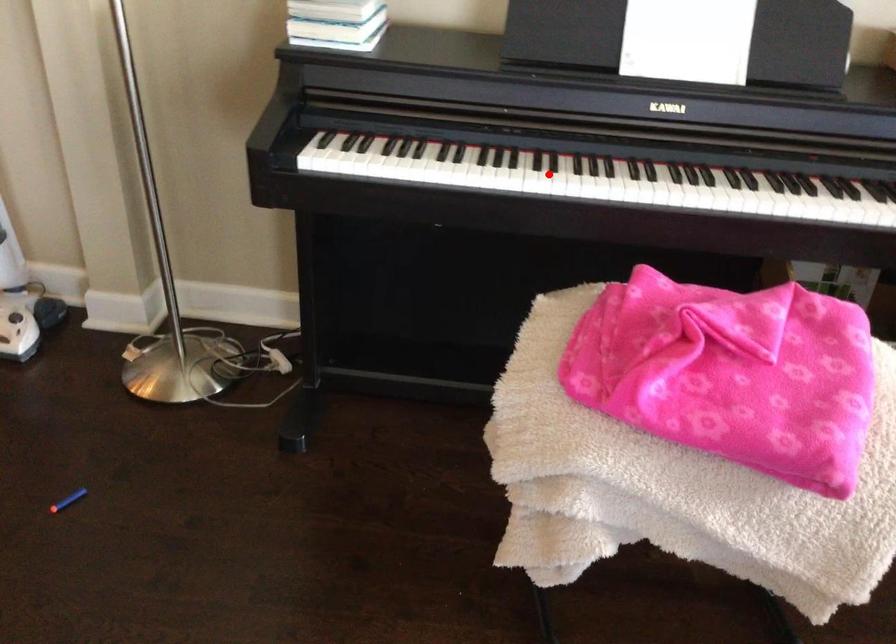
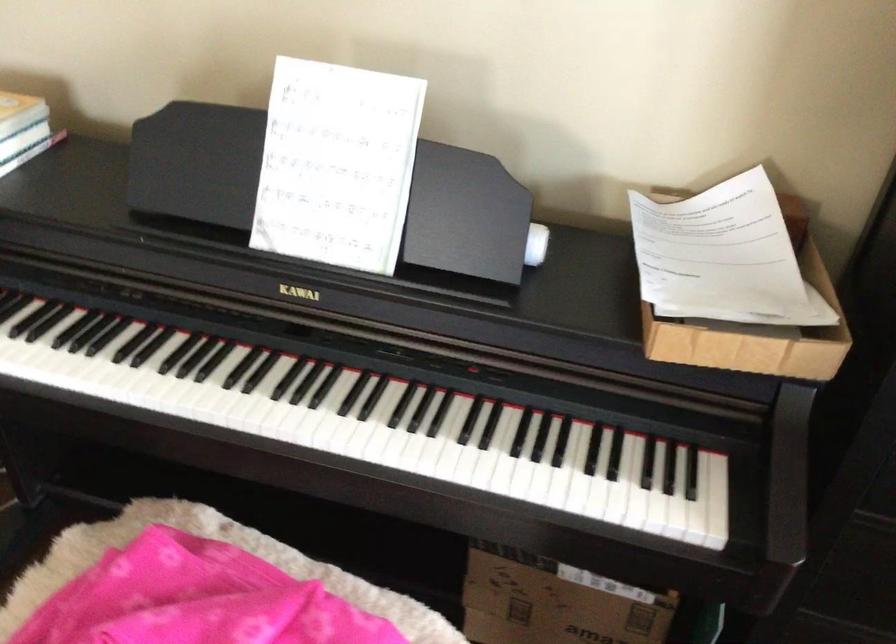
The point at the highlighted location is marked in the first image. Where is the corresponding point in the second image?

(116, 382)